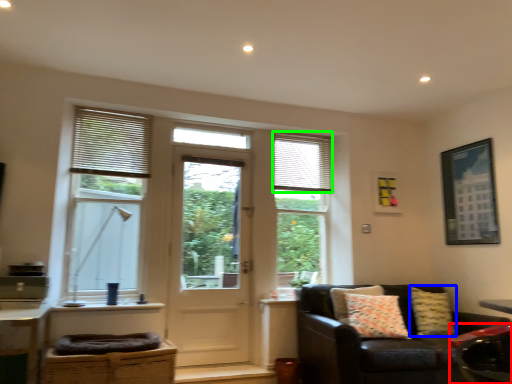
Question: Estimate the real-world distances between objects in this image. Which object is closer to swivel chair (highlighted by a red box), pillow (highlighted by a blue box) or shutter (highlighted by a green box)?

Choices:
 (A) pillow
 (B) shutter

Answer: (A)